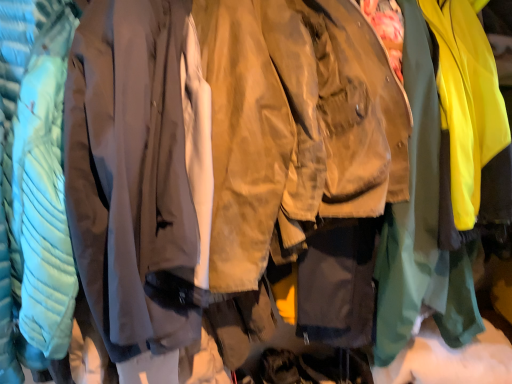
Question: Is matte gray sweatshirt at center, acting as the 1th sweatshirt starting from the left, smaller than tan suede jacket at center, placed as the 2th sweatshirt when sorted from left to right?

Choices:
 (A) yes
 (B) no

Answer: (B)

Question: Is matte gray sweatshirt at center, the second sweatshirt when ordered from right to left, to the left of tan suede jacket at center, the 1th sweatshirt viewed from the right, from the viewer's perspective?

Choices:
 (A) yes
 (B) no

Answer: (A)

Question: Is matte gray sweatshirt at center, acting as the 1th sweatshirt starting from the left, not within tan suede jacket at center, the 1th sweatshirt viewed from the right?

Choices:
 (A) yes
 (B) no

Answer: (A)

Question: From the image's perspective, is matte gray sweatshirt at center, the second sweatshirt when ordered from right to left, located beneath tan suede jacket at center, placed as the 2th sweatshirt when sorted from left to right?

Choices:
 (A) yes
 (B) no

Answer: (A)

Question: Considering the relative sizes of matte gray sweatshirt at center, acting as the 1th sweatshirt starting from the left, and tan suede jacket at center, placed as the 2th sweatshirt when sorted from left to right, in the image provided, is matte gray sweatshirt at center, acting as the 1th sweatshirt starting from the left, shorter than tan suede jacket at center, placed as the 2th sweatshirt when sorted from left to right,?

Choices:
 (A) no
 (B) yes

Answer: (A)

Question: Is matte gray sweatshirt at center, the second sweatshirt when ordered from right to left, thinner than tan suede jacket at center, the 1th sweatshirt viewed from the right?

Choices:
 (A) yes
 (B) no

Answer: (A)

Question: Considering the relative positions of tan suede jacket at center, the 1th sweatshirt viewed from the right, and matte gray sweatshirt at center, the second sweatshirt when ordered from right to left, in the image provided, is tan suede jacket at center, the 1th sweatshirt viewed from the right, to the right of matte gray sweatshirt at center, the second sweatshirt when ordered from right to left, from the viewer's perspective?

Choices:
 (A) no
 (B) yes

Answer: (B)

Question: Is tan suede jacket at center, the 1th sweatshirt viewed from the right, thinner than matte gray sweatshirt at center, acting as the 1th sweatshirt starting from the left?

Choices:
 (A) no
 (B) yes

Answer: (A)

Question: Can you confirm if tan suede jacket at center, the 1th sweatshirt viewed from the right, is taller than matte gray sweatshirt at center, the second sweatshirt when ordered from right to left?

Choices:
 (A) yes
 (B) no

Answer: (B)

Question: Are tan suede jacket at center, the 1th sweatshirt viewed from the right, and matte gray sweatshirt at center, acting as the 1th sweatshirt starting from the left, making contact?

Choices:
 (A) yes
 (B) no

Answer: (B)

Question: Is the depth of tan suede jacket at center, the 1th sweatshirt viewed from the right, greater than that of matte gray sweatshirt at center, the second sweatshirt when ordered from right to left?

Choices:
 (A) yes
 (B) no

Answer: (A)

Question: Can you confirm if tan suede jacket at center, placed as the 2th sweatshirt when sorted from left to right, is smaller than matte gray sweatshirt at center, acting as the 1th sweatshirt starting from the left?

Choices:
 (A) yes
 (B) no

Answer: (A)

Question: Based on their sizes in the image, would you say matte gray sweatshirt at center, the second sweatshirt when ordered from right to left, is bigger or smaller than tan suede jacket at center, the 1th sweatshirt viewed from the right?

Choices:
 (A) big
 (B) small

Answer: (A)